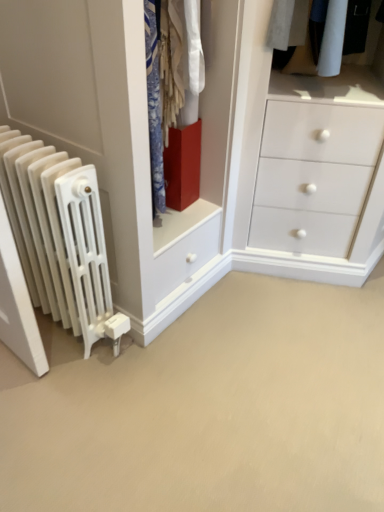
Describe the element at coordinates (122, 139) in the screenshot. I see `matte red cube at center` at that location.

Where is `white matte radiator at left`? white matte radiator at left is located at coordinates (60, 236).

Identify the location of matte red cube at center. (122, 139).

Considering the positions of point (125, 170) and point (80, 477), is point (125, 170) closer or farther from the camera than point (80, 477)?

Point (125, 170) is positioned closer to the camera compared to point (80, 477).

Is matte red cube at center oriented towards white matte radiator at left?

No, matte red cube at center is not facing towards white matte radiator at left.

Could white matte radiator at left be considered to be inside matte red cube at center?

Definitely not — white matte radiator at left is not inside matte red cube at center.

Locate an element on the screen. The height and width of the screenshot is (512, 384). closet that is above the white matte radiator at left (from a real-world perspective) is located at coordinates (122, 139).

Consider the image. Is white matte radiator at left facing towards white matte radiator at left?

No.

Which object is positioned more to the right, white matte radiator at left or white matte radiator at left?

From the viewer's perspective, white matte radiator at left appears more on the right side.

Relative to white matte radiator at left, is white matte radiator at left in front or behind?

Clearly, white matte radiator at left is behind white matte radiator at left.

Is white matte radiator at left bigger or smaller than white matte radiator at left?

white matte radiator at left is smaller than white matte radiator at left.

I want to click on closet above the white matte radiator at left (from a real-world perspective), so (x=122, y=139).

From the image's perspective, is matte red cube at center located above white matte radiator at left?

Correct, matte red cube at center appears higher than white matte radiator at left in the image.

Is point (111, 83) more distant than point (46, 253)?

No, (111, 83) is in front of (46, 253).

From a real-world perspective, does matte red cube at center stand above white matte radiator at left?

Yes.

Considering the relative sizes of white matte radiator at left and matte red cube at center in the image provided, is white matte radiator at left taller than matte red cube at center?

No, white matte radiator at left is not taller than matte red cube at center.

From a real-world perspective, is white matte radiator at left located beneath matte red cube at center?

Yes, from a real-world perspective, white matte radiator at left is under matte red cube at center.

Is white matte radiator at left not close to matte red cube at center?

Actually, white matte radiator at left and matte red cube at center are a little close together.

From the picture: From the image's perspective, is white matte radiator at left above or below matte red cube at center?

Based on their image positions, white matte radiator at left is located beneath matte red cube at center.

From a real-world perspective, is white matte radiator at left beneath matte red cube at center?

Yes, from a real-world perspective, white matte radiator at left is under matte red cube at center.

From their relative heights in the image, would you say white matte radiator at left is taller or shorter than matte red cube at center?

In the image, white matte radiator at left appears to be taller than matte red cube at center.

From the image's perspective, between white matte radiator at left and matte red cube at center, who is located below?

From the image's view, white matte radiator at left is below.

Can you see white matte radiator at left touching white matte radiator at left?

white matte radiator at left is not next to white matte radiator at left, and they're not touching.

Which object is closer to the camera taking this photo, white matte radiator at left or white matte radiator at left?

white matte radiator at left is more forward.

Can you tell me how much white matte radiator at left and white matte radiator at left differ in facing direction?

177 degrees.

Which point is more forward, (331, 498) or (51, 209)?

The point (331, 498) is in front.

Locate an element on the screen. plain lying below the matte red cube at center (from the image's perspective) is located at coordinates (208, 407).

You are a GUI agent. You are given a task and a screenshot of the screen. Output one action in this format:
    pyautogui.click(x=<x>, y=<y>)
    Task: Click on the radiator that appears on the left of white matte radiator at left
    The image size is (384, 512).
    Given the screenshot: What is the action you would take?
    pyautogui.click(x=60, y=236)

In the scene shown: From the image, which object appears to be nearer to white matte radiator at left, white matte radiator at left or matte red cube at center?

white matte radiator at left.

When comparing their distances from white matte radiator at left, does white matte radiator at left or matte red cube at center seem further?

white matte radiator at left.

In the scene shown: Based on their spatial positions, is matte red cube at center or white matte radiator at left closer to white matte radiator at left?

Among the two, matte red cube at center is located nearer to white matte radiator at left.

From the image, which object appears to be farther from matte red cube at center, white matte radiator at left or white matte radiator at left?

white matte radiator at left.

From the image, which object appears to be farther from matte red cube at center, white matte radiator at left or white matte radiator at left?

white matte radiator at left is positioned further to the anchor matte red cube at center.

Considering their positions, is matte red cube at center positioned closer to white matte radiator at left than white matte radiator at left?

Based on the image, white matte radiator at left appears to be nearer to white matte radiator at left.

The height and width of the screenshot is (512, 384). What are the coordinates of `closet situated between white matte radiator at left and white matte radiator at left from left to right` in the screenshot? It's located at (122, 139).